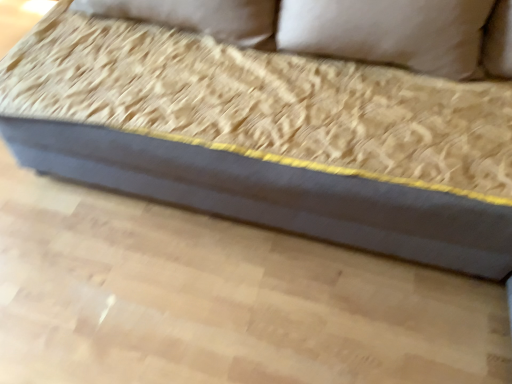
The width and height of the screenshot is (512, 384). What do you see at coordinates (389, 31) in the screenshot?
I see `beige fabric pillow at upper center` at bounding box center [389, 31].

Find the location of a particular element. This screenshot has height=384, width=512. beige fabric pillow at upper center is located at coordinates (389, 31).

What is the approximate width of beige fabric pillow at upper center?

9.57 inches.

The height and width of the screenshot is (384, 512). Describe the element at coordinates (256, 147) in the screenshot. I see `dark gray fabric couch at center` at that location.

Measure the distance between point (94, 86) and camera.

3.76 feet.

I want to click on dark gray fabric couch at center, so click(x=256, y=147).

Locate an element on the screen. beige fabric pillow at upper center is located at coordinates (389, 31).

Considering the positions of objects dark gray fabric couch at center and beige fabric pillow at upper center in the image provided, who is more to the right, dark gray fabric couch at center or beige fabric pillow at upper center?

From the viewer's perspective, beige fabric pillow at upper center appears more on the right side.

Considering the relative positions of dark gray fabric couch at center and beige fabric pillow at upper center in the image provided, is dark gray fabric couch at center behind beige fabric pillow at upper center?

No, it is not.

Which point is more distant from viewer, [399,134] or [306,31]?

Point [306,31]

From the image's perspective, which is below, dark gray fabric couch at center or beige fabric pillow at upper center?

dark gray fabric couch at center, from the image's perspective.

From a real-world perspective, who is located higher, dark gray fabric couch at center or beige fabric pillow at upper center?

From a 3D spatial view, beige fabric pillow at upper center is above.

Can you confirm if dark gray fabric couch at center is thinner than beige fabric pillow at upper center?

No.

Considering the relative sizes of dark gray fabric couch at center and beige fabric pillow at upper center in the image provided, is dark gray fabric couch at center taller than beige fabric pillow at upper center?

Yes, dark gray fabric couch at center is taller than beige fabric pillow at upper center.

Between dark gray fabric couch at center and beige fabric pillow at upper center, which one has larger size?

With larger size is dark gray fabric couch at center.

In the scene shown: Would you say dark gray fabric couch at center is outside beige fabric pillow at upper center?

dark gray fabric couch at center is positioned outside beige fabric pillow at upper center.

From the picture: Is dark gray fabric couch at center not near beige fabric pillow at upper center?

No, dark gray fabric couch at center is in close proximity to beige fabric pillow at upper center.

Is dark gray fabric couch at center facing towards beige fabric pillow at upper center?

Yes, dark gray fabric couch at center faces towards beige fabric pillow at upper center.

What are the coordinates of `pillow that appears above the dark gray fabric couch at center (from a real-world perspective)` in the screenshot? It's located at (389, 31).

In the image, is beige fabric pillow at upper center on the left side or the right side of dark gray fabric couch at center?

From the image, it's evident that beige fabric pillow at upper center is to the right of dark gray fabric couch at center.

Which object is further away from the camera, beige fabric pillow at upper center or dark gray fabric couch at center?

beige fabric pillow at upper center is further from the camera.

Is point (300, 5) farther from camera compared to point (368, 172)?

Yes, point (300, 5) is farther from viewer.

From the image's perspective, is beige fabric pillow at upper center positioned above or below dark gray fabric couch at center?

Clearly, from the image's perspective, beige fabric pillow at upper center is above dark gray fabric couch at center.

From a real-world perspective, is beige fabric pillow at upper center on dark gray fabric couch at center?

Yes.

Is beige fabric pillow at upper center wider or thinner than dark gray fabric couch at center?

Clearly, beige fabric pillow at upper center has less width compared to dark gray fabric couch at center.

Does beige fabric pillow at upper center have a greater height compared to dark gray fabric couch at center?

In fact, beige fabric pillow at upper center may be shorter than dark gray fabric couch at center.

Who is smaller, beige fabric pillow at upper center or dark gray fabric couch at center?

Smaller between the two is beige fabric pillow at upper center.

Can we say beige fabric pillow at upper center lies outside dark gray fabric couch at center?

Actually, beige fabric pillow at upper center is at least partially inside dark gray fabric couch at center.

Looking at this image, is the surface of beige fabric pillow at upper center in direct contact with dark gray fabric couch at center?

No, beige fabric pillow at upper center is not in contact with dark gray fabric couch at center.

Is beige fabric pillow at upper center oriented away from dark gray fabric couch at center?

Correct, beige fabric pillow at upper center is looking away from dark gray fabric couch at center.

How different are the orientations of beige fabric pillow at upper center and dark gray fabric couch at center in degrees?

beige fabric pillow at upper center and dark gray fabric couch at center are facing 1.45 degrees away from each other.

Measure the distance from beige fabric pillow at upper center to dark gray fabric couch at center.

beige fabric pillow at upper center is 12.55 inches from dark gray fabric couch at center.

In the image, there is a dark gray fabric couch at center. In order to click on pillow above it (from the image's perspective) in this screenshot , I will do `click(389, 31)`.

Where is `pillow to the right of dark gray fabric couch at center`? The height and width of the screenshot is (384, 512). pillow to the right of dark gray fabric couch at center is located at coordinates (389, 31).

Locate an element on the screen. studio couch that is on the left side of beige fabric pillow at upper center is located at coordinates (256, 147).